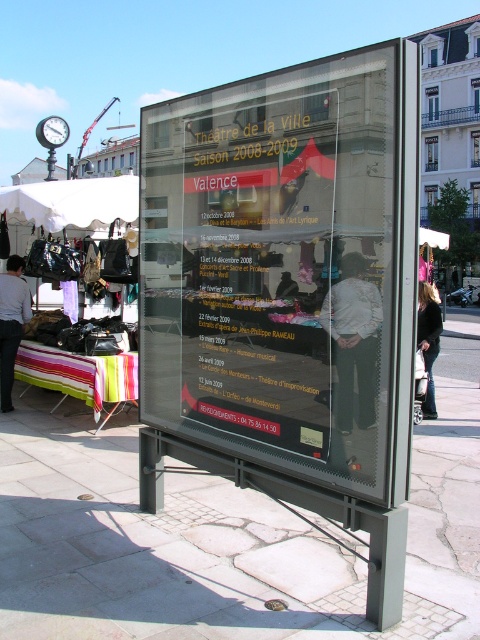
You are a customer at the market and see the black leather jacket at lower right and the matte black shirt at center. Which item is taller?

The black leather jacket at lower right is much taller than the matte black shirt at center.

You are a customer at the street market and see the light gray shirt at lower left. If you want to find its exact location on the display board, which coordinates should you look at?

The light gray shirt at lower left is located at coordinates point (12, 323).

You are a photographer standing at the camera position. You want to take a photo of the light gray shirt at lower left. Can you capture it in your current position?

The light gray shirt at lower left is 7.30 meters from camera, so yes, you can capture it in your current position as it is within the camera range.